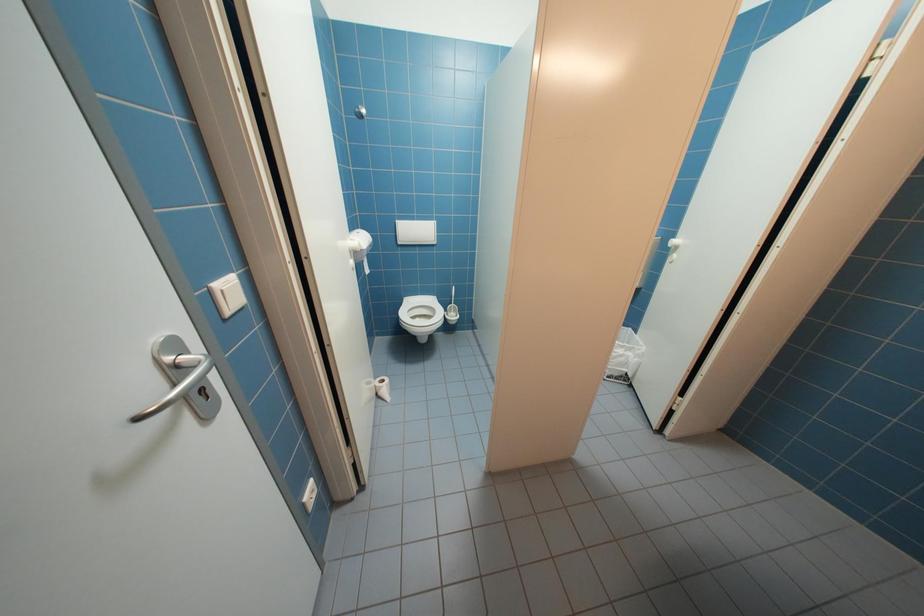
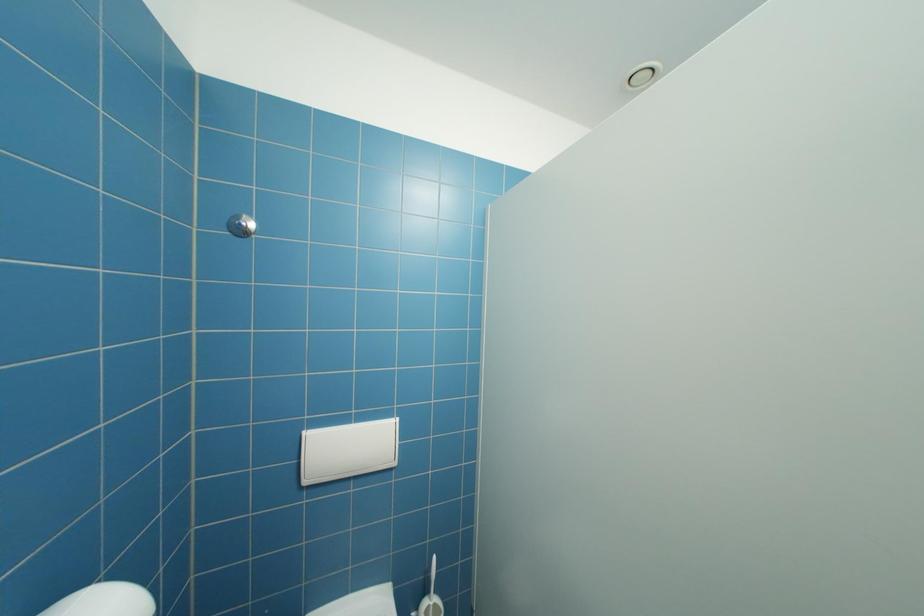
Question: Which direction would the cameraman need to move to produce the second image? Reply with the corresponding letter.

Choices:
 (A) Left
 (B) Right
 (C) Forward
 (D) Backward

Answer: (C)